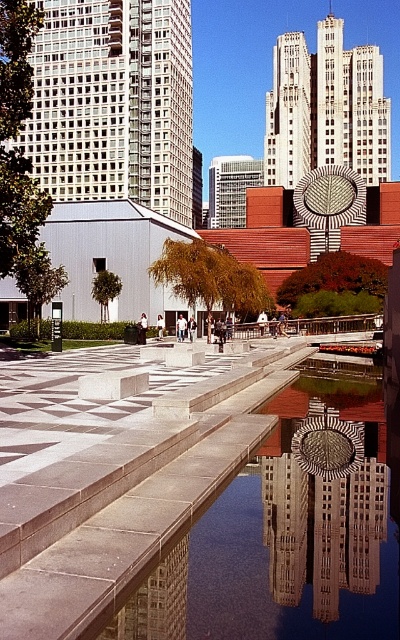
Is smooth concrete waterway at center positioned before reflective glass sculpture at center?

That is True.

Can you confirm if smooth concrete waterway at center is thinner than reflective glass sculpture at center?

Incorrect, smooth concrete waterway at center's width is not less than reflective glass sculpture at center's.

Identify the location of smooth concrete waterway at center. (291, 529).